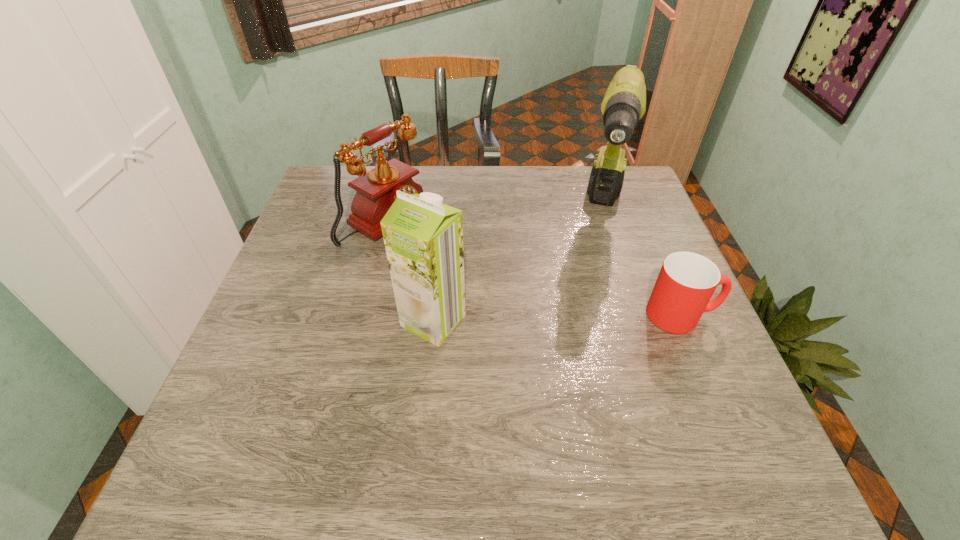
In order to click on vacant point located 0.400m on the dial of the telephone in this screenshot , I will do `click(548, 313)`.

Locate an element on the screen. drill present at the far edge is located at coordinates (624, 104).

Where is `telephone that is at the far edge`? The image size is (960, 540). telephone that is at the far edge is located at coordinates (376, 190).

Locate an element on the screen. The width and height of the screenshot is (960, 540). object that is positioned at the left edge is located at coordinates (376, 190).

Where is `cup present at the right edge`? cup present at the right edge is located at coordinates (686, 282).

Locate an element on the screen. The image size is (960, 540). drill that is at the right edge is located at coordinates (624, 104).

You are a GUI agent. You are given a task and a screenshot of the screen. Output one action in this format:
    pyautogui.click(x=<x>, y=<y>)
    Task: Click on the object positioned at the far left corner
    
    Given the screenshot: What is the action you would take?
    pyautogui.click(x=376, y=190)

Find the location of a particular element. This screenshot has height=540, width=960. object located at the far right corner is located at coordinates (624, 104).

In the image, there is a desktop. Identify the location of free region at the far edge. (448, 183).

At what (x,y) coordinates should I click in order to perform the action: click on free space at the left edge of the desktop. Please return your answer as a coordinate pair (x, y). Looking at the image, I should click on (263, 362).